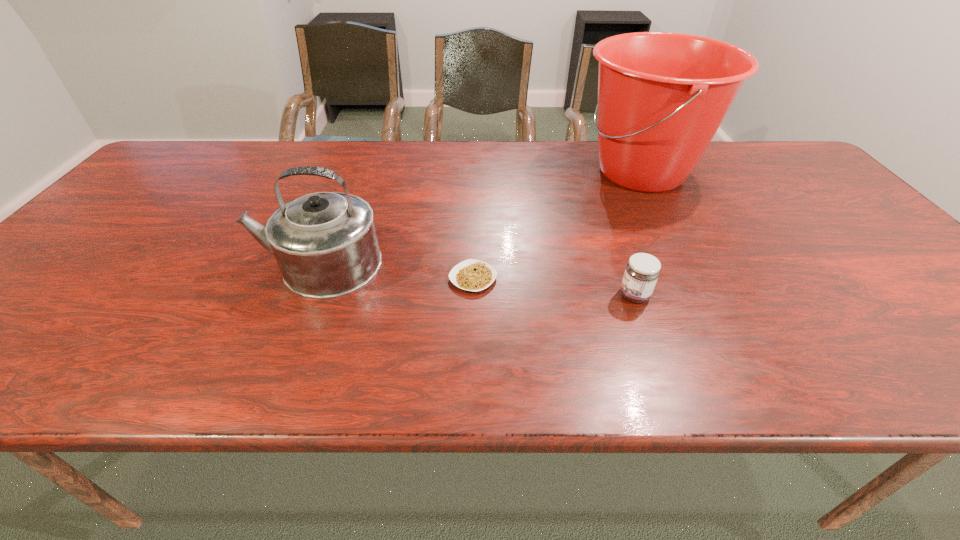
Locate an element on the screen. The width and height of the screenshot is (960, 540). the farthest object is located at coordinates (662, 96).

Find the location of a particular element. This screenshot has width=960, height=540. bucket is located at coordinates (662, 96).

Where is `kettle`? The height and width of the screenshot is (540, 960). kettle is located at coordinates (325, 243).

Where is `the leftmost object`? This screenshot has height=540, width=960. the leftmost object is located at coordinates (325, 243).

Locate an element on the screen. The height and width of the screenshot is (540, 960). jam is located at coordinates (642, 271).

This screenshot has height=540, width=960. I want to click on the shortest object, so click(x=474, y=275).

Find the location of a particular element. the third object from right to left is located at coordinates point(474,275).

Identify the location of vacant area situated with the handle attached to the rim of the bucket. This screenshot has width=960, height=540. (533, 172).

Locate an element on the screen. The image size is (960, 540). free region located 0.140m with the handle attached to the rim of the bucket is located at coordinates (529, 172).

Where is `free space located 0.170m with the handle attached to the rim of the bucket`? Image resolution: width=960 pixels, height=540 pixels. free space located 0.170m with the handle attached to the rim of the bucket is located at coordinates (519, 172).